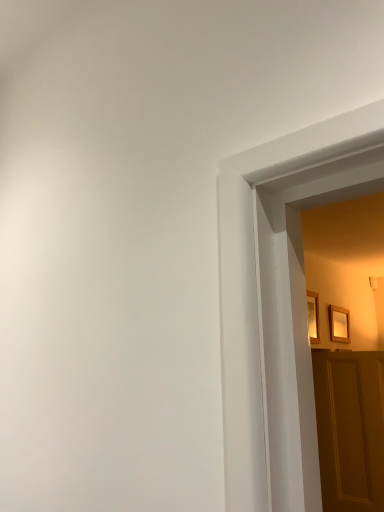
The height and width of the screenshot is (512, 384). I want to click on wooden panelled door at right, so click(x=350, y=429).

What do you see at coordinates (339, 324) in the screenshot? This screenshot has width=384, height=512. I see `wooden picture frame at upper right, the 1th picture frame in the right-to-left sequence` at bounding box center [339, 324].

Describe the element at coordinates (313, 316) in the screenshot. The width and height of the screenshot is (384, 512). I see `wooden picture frame at upper right, the 2th picture frame in the back-to-front sequence` at that location.

The image size is (384, 512). I want to click on wooden panelled door at right, so click(350, 429).

Which of these two, wooden picture frame at upper right, the 2th picture frame in the back-to-front sequence, or wooden panelled door at right, is wider?

With larger width is wooden panelled door at right.

Would you say wooden picture frame at upper right, the second picture frame from the right, is outside wooden panelled door at right?

wooden picture frame at upper right, the second picture frame from the right, is positioned outside wooden panelled door at right.

Who is bigger, wooden picture frame at upper right, the second picture frame from the right, or wooden panelled door at right?

wooden panelled door at right is bigger.

From the image's perspective, is wooden panelled door at right on wooden picture frame at upper right, the 1th picture frame in the right-to-left sequence?

Incorrect, from the image's perspective, wooden panelled door at right is lower than wooden picture frame at upper right, the 1th picture frame in the right-to-left sequence.

Could you tell me if wooden panelled door at right is facing wooden picture frame at upper right, marked as the first picture frame in a back-to-front arrangement?

No.

Does wooden panelled door at right touch wooden picture frame at upper right, the 2th picture frame in the front-to-back sequence?

No, wooden panelled door at right is not touching wooden picture frame at upper right, the 2th picture frame in the front-to-back sequence.

Consider the image. Is wooden panelled door at right facing towards wooden picture frame at upper right, the first picture frame from the front?

No.

Locate an element on the screen. Image resolution: width=384 pixels, height=512 pixels. picture frame that appears on the left of wooden panelled door at right is located at coordinates (313, 316).

Is point (375, 368) positioned after point (317, 315)?

No, (375, 368) is closer to viewer.

Considering the relative sizes of wooden panelled door at right and wooden picture frame at upper right, the second picture frame from the right, in the image provided, is wooden panelled door at right wider than wooden picture frame at upper right, the second picture frame from the right,?

Correct, the width of wooden panelled door at right exceeds that of wooden picture frame at upper right, the second picture frame from the right.

From a real-world perspective, which object rests below the other?

wooden picture frame at upper right, the 2th picture frame in the front-to-back sequence, is physically lower.

Would you say wooden picture frame at upper right, the 2th picture frame in the front-to-back sequence, contains wooden picture frame at upper right, the second picture frame from the right?

No, wooden picture frame at upper right, the second picture frame from the right, is not inside wooden picture frame at upper right, the 2th picture frame in the front-to-back sequence.

Is wooden picture frame at upper right, which ranks as the second picture frame in left-to-right order, taller than wooden picture frame at upper right, the second picture frame from the right?

Incorrect, the height of wooden picture frame at upper right, which ranks as the second picture frame in left-to-right order, is not larger of that of wooden picture frame at upper right, the second picture frame from the right.

From the picture: Considering the relative positions of wooden picture frame at upper right, marked as the first picture frame in a back-to-front arrangement, and wooden picture frame at upper right, the first picture frame from the front, in the image provided, is wooden picture frame at upper right, marked as the first picture frame in a back-to-front arrangement, in front of wooden picture frame at upper right, the first picture frame from the front,?

No, wooden picture frame at upper right, marked as the first picture frame in a back-to-front arrangement, is behind wooden picture frame at upper right, the first picture frame from the front.

Relative to wooden panelled door at right, is wooden picture frame at upper right, the 1th picture frame in the right-to-left sequence, in front or behind?

Clearly, wooden picture frame at upper right, the 1th picture frame in the right-to-left sequence, is behind wooden panelled door at right.

From a real-world perspective, between wooden picture frame at upper right, marked as the first picture frame in a back-to-front arrangement, and wooden panelled door at right, who is vertically higher?

From a 3D spatial view, wooden picture frame at upper right, marked as the first picture frame in a back-to-front arrangement, is above.

Can you confirm if wooden picture frame at upper right, the first picture frame from the front, is positioned to the left of wooden picture frame at upper right, the 2th picture frame in the front-to-back sequence?

Yes.

Looking at this image, are wooden picture frame at upper right, the 2th picture frame in the back-to-front sequence, and wooden picture frame at upper right, the 2th picture frame in the front-to-back sequence, located far from each other?

No, wooden picture frame at upper right, the 2th picture frame in the back-to-front sequence, is not far from wooden picture frame at upper right, the 2th picture frame in the front-to-back sequence.

Does wooden picture frame at upper right, the second picture frame from the right, come behind wooden picture frame at upper right, marked as the first picture frame in a back-to-front arrangement?

No, it is not.

In terms of height, does wooden picture frame at upper right, the second picture frame from the right, look taller or shorter compared to wooden picture frame at upper right, the 2th picture frame in the front-to-back sequence?

In the image, wooden picture frame at upper right, the second picture frame from the right, appears to be taller than wooden picture frame at upper right, the 2th picture frame in the front-to-back sequence.

Where is `the 2nd picture frame located above the wooden panelled door at right (from a real-world perspective)`? The width and height of the screenshot is (384, 512). the 2nd picture frame located above the wooden panelled door at right (from a real-world perspective) is located at coordinates (313, 316).

The height and width of the screenshot is (512, 384). In order to click on door located in front of the wooden picture frame at upper right, the 1th picture frame in the right-to-left sequence in this screenshot , I will do `click(350, 429)`.

When comparing their distances from wooden picture frame at upper right, which ranks as the second picture frame in left-to-right order, does wooden panelled door at right or wooden picture frame at upper right, the second picture frame from the right, seem closer?

The object closer to wooden picture frame at upper right, which ranks as the second picture frame in left-to-right order, is wooden picture frame at upper right, the second picture frame from the right.

Looking at the image, which one is located closer to wooden picture frame at upper right, the first picture frame from the front, wooden picture frame at upper right, the 1th picture frame in the right-to-left sequence, or wooden panelled door at right?

wooden picture frame at upper right, the 1th picture frame in the right-to-left sequence, is positioned closer to the anchor wooden picture frame at upper right, the first picture frame from the front.

Which object lies further to the anchor point wooden panelled door at right, wooden picture frame at upper right, the second picture frame from the right, or wooden picture frame at upper right, marked as the first picture frame in a back-to-front arrangement?

wooden picture frame at upper right, marked as the first picture frame in a back-to-front arrangement, lies further to wooden panelled door at right than the other object.

From the image, which object appears to be farther from wooden picture frame at upper right, acting as the 1th picture frame starting from the left, wooden panelled door at right or wooden picture frame at upper right, the 1th picture frame in the right-to-left sequence?

wooden panelled door at right.

Based on their spatial positions, is wooden picture frame at upper right, marked as the first picture frame in a back-to-front arrangement, or wooden picture frame at upper right, the second picture frame from the right, closer to wooden panelled door at right?

wooden picture frame at upper right, the second picture frame from the right, lies closer to wooden panelled door at right than the other object.

Which object lies nearer to the anchor point wooden picture frame at upper right, which ranks as the second picture frame in left-to-right order, wooden picture frame at upper right, the second picture frame from the right, or wooden panelled door at right?

wooden picture frame at upper right, the second picture frame from the right, is closer to wooden picture frame at upper right, which ranks as the second picture frame in left-to-right order.

Locate an element on the screen. The image size is (384, 512). picture frame between wooden picture frame at upper right, acting as the 1th picture frame starting from the left, and wooden panelled door at right vertically is located at coordinates (339, 324).